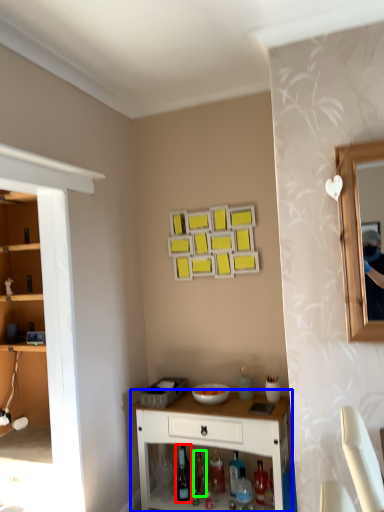
Question: Which is farther away from wine bottle (highlighted by a red box)? desk (highlighted by a blue box) or bottle (highlighted by a green box)?

Choices:
 (A) desk
 (B) bottle

Answer: (A)